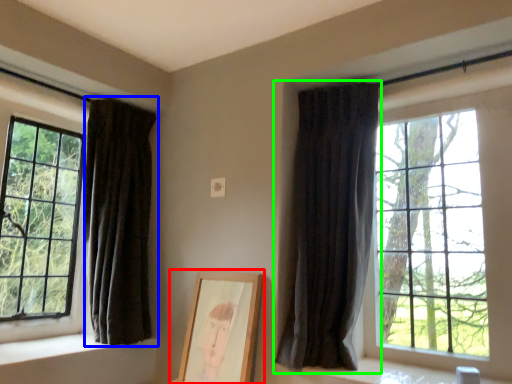
Question: Which object is positioned farthest from picture frame (highlighted by a red box)? Select from curtain (highlighted by a blue box) and curtain (highlighted by a green box).

Choices:
 (A) curtain
 (B) curtain

Answer: (A)